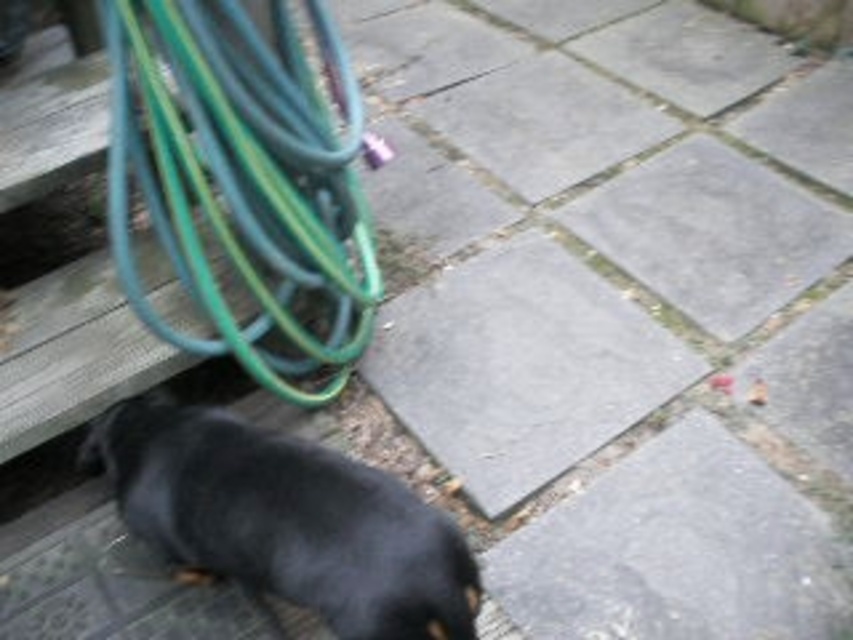
You are a photographer trying to capture the black smooth dog at lower left and the green rubber hose at upper left in the same frame. Which object would appear wider in the photo?

The black smooth dog at lower left would appear wider in the photo since the green rubber hose at upper left has a lesser width compared to it.

You are a delivery robot with a 12 inch wide package. You need to navigate between the green rubber hose at upper left and the black smooth dog at lower left. Can you fit through the space between them?

The green rubber hose at upper left and the black smooth dog at lower left are 16.48 inches apart from each other. Since the package is 12 inches wide, there is enough space for the delivery robot to navigate through the gap between them.